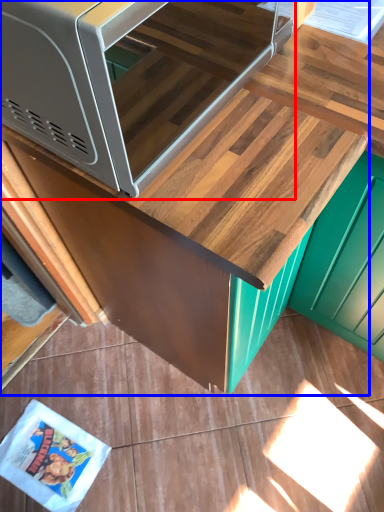
Question: Which object appears closest to the camera in this image, microwave (highlighted by a red box) or cabinetry (highlighted by a blue box)?

Choices:
 (A) microwave
 (B) cabinetry

Answer: (A)